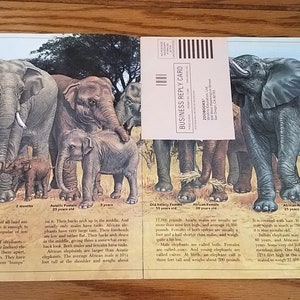
Identify the location of table. (249, 289), (228, 17), (46, 9).